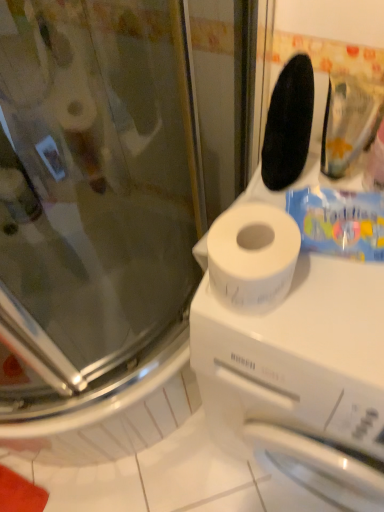
Describe the element at coordinates (300, 377) in the screenshot. I see `white matte toilet paper at upper right` at that location.

Measure the distance between white matte toilet paper at upper right and camera.

white matte toilet paper at upper right and camera are 19.72 inches apart from each other.

The image size is (384, 512). In order to click on white matte toilet paper at upper right in this screenshot , I will do `click(300, 377)`.

Identify the location of white matte toilet paper at upper right. (300, 377).